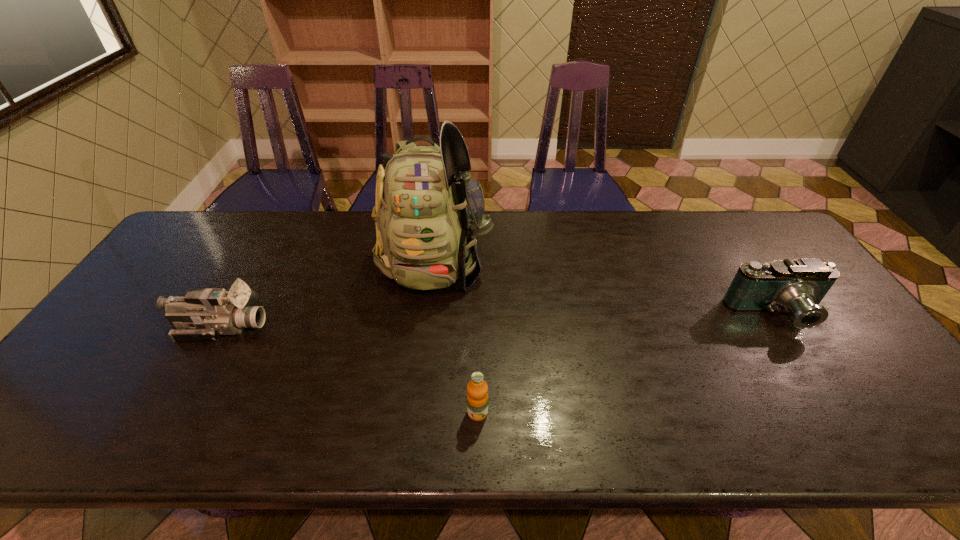
You are a GUI agent. You are given a task and a screenshot of the screen. Output one action in this format:
    pyautogui.click(x=<x>, y=<y>)
    Task: Click on the free space at the far edge of the desktop
    Image resolution: width=960 pixels, height=540 pixels.
    Given the screenshot: What is the action you would take?
    pyautogui.click(x=717, y=254)

The image size is (960, 540). In the image, there is a desktop. What are the coordinates of `vacant space at the near edge` in the screenshot? It's located at (210, 445).

In the image, there is a desktop. Identify the location of vacant space at the right edge. (x=848, y=399).

Where is `vacant area at the far right corner`? This screenshot has height=540, width=960. vacant area at the far right corner is located at coordinates (747, 233).

I want to click on vacant area that lies between the orange juice and the left camcorder, so click(x=350, y=370).

At what (x,y) coordinates should I click in order to perform the action: click on empty space that is in between the rightmost object and the tallest object. Please return your answer as a coordinate pair (x, y). Looking at the image, I should click on (606, 287).

Locate an element on the screen. Image resolution: width=960 pixels, height=540 pixels. vacant space that is in between the rightmost object and the orange juice is located at coordinates (627, 364).

This screenshot has height=540, width=960. I want to click on free space between the backpack and the left camcorder, so click(329, 293).

I want to click on blank region between the rightmost object and the leftmost object, so click(499, 322).

Find the location of a particular element. free space between the orange juice and the tallest object is located at coordinates (457, 335).